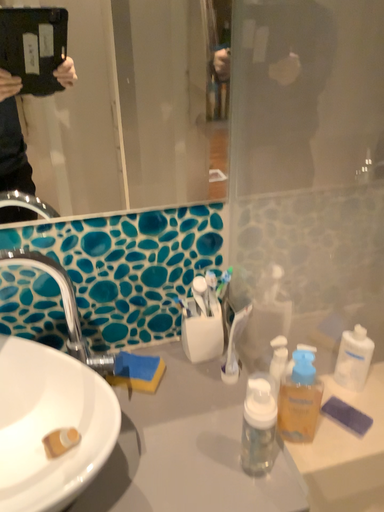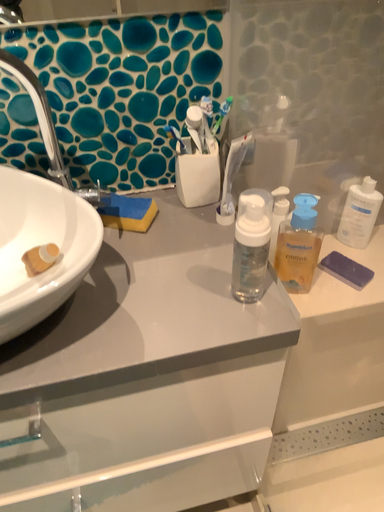
Question: How did the camera likely rotate when shooting the video?

Choices:
 (A) rotated upward
 (B) rotated downward

Answer: (B)